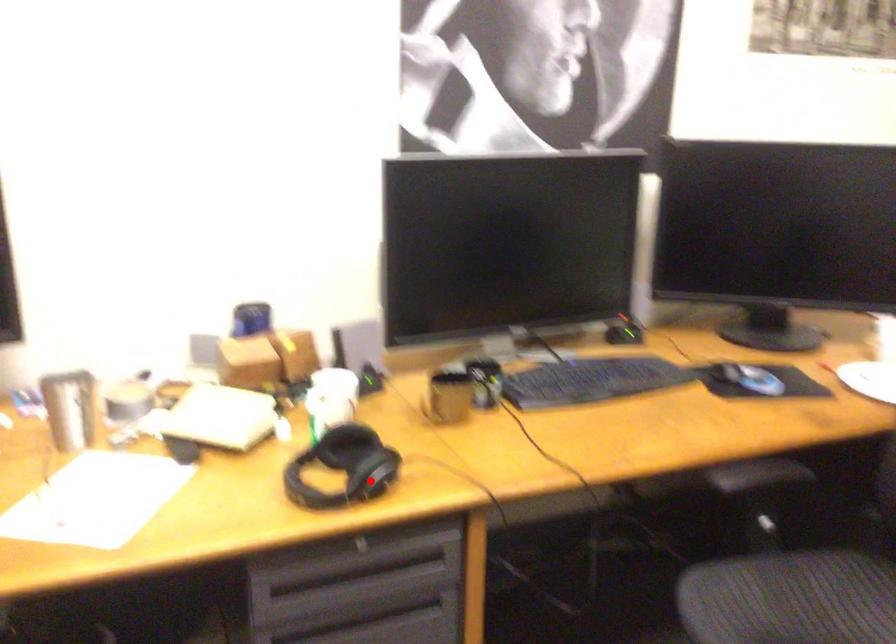
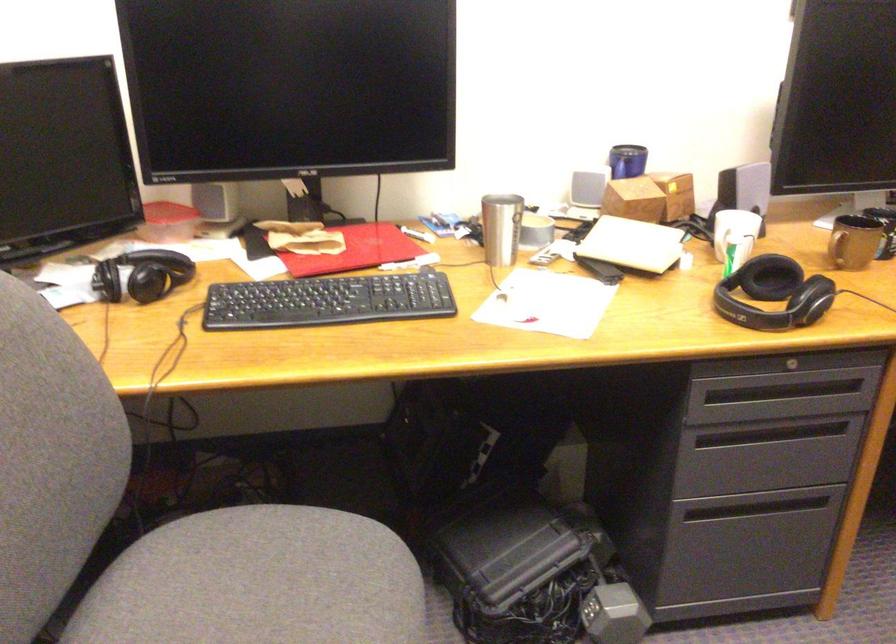
The point at the highlighted location is marked in the first image. Where is the corresponding point in the second image?

(810, 299)